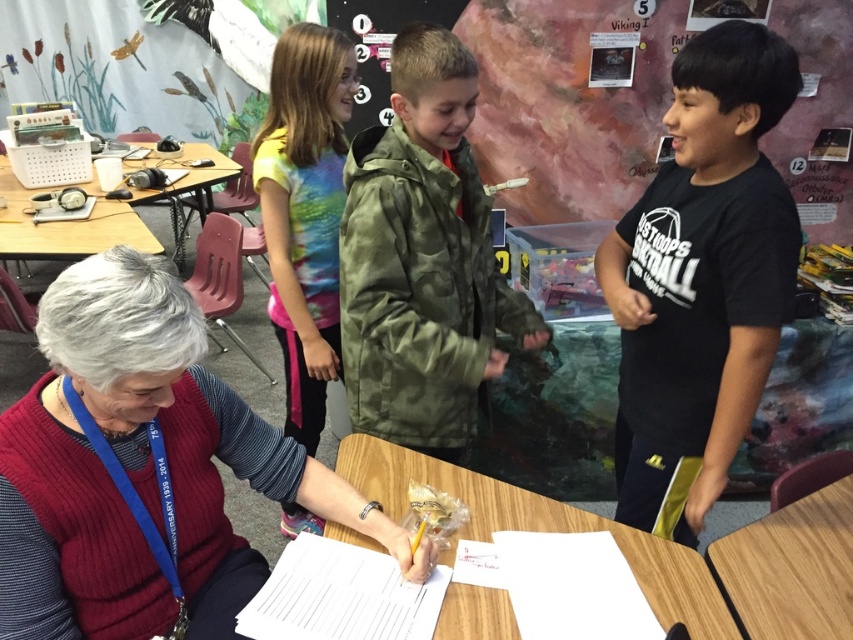
Does black matte shirt at center have a larger size compared to wooden table at center?

Indeed, black matte shirt at center has a larger size compared to wooden table at center.

Can you confirm if black matte shirt at center is positioned to the right of wooden table at center?

Indeed, black matte shirt at center is positioned on the right side of wooden table at center.

The height and width of the screenshot is (640, 853). I want to click on black matte shirt at center, so click(701, 278).

Where is `black matte shirt at center`? black matte shirt at center is located at coordinates (701, 278).

Who is higher up, camouflage jacket at center or wooden table at lower right?

camouflage jacket at center

Who is lower down, camouflage jacket at center or wooden table at lower right?

wooden table at lower right

Is point (426, 419) more distant than point (781, 600)?

Yes, it is behind point (781, 600).

At what (x,y) coordinates should I click in order to perform the action: click on camouflage jacket at center. Please return your answer as a coordinate pair (x, y). The width and height of the screenshot is (853, 640). Looking at the image, I should click on (422, 259).

How far apart are wooden table at lower right and wooden table at left?

wooden table at lower right and wooden table at left are 8.16 feet apart.

Does wooden table at lower right have a smaller size compared to wooden table at left?

Correct, wooden table at lower right occupies less space than wooden table at left.

Which is in front, point (764, 580) or point (113, 204)?

Point (764, 580) is more forward.

Where is `wooden table at lower right`? wooden table at lower right is located at coordinates (790, 568).